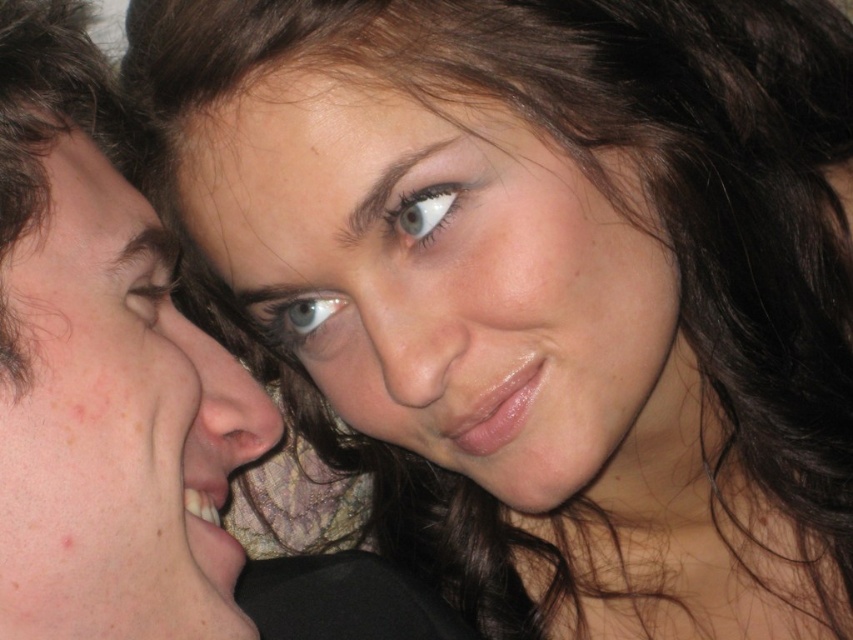
You are a photographer analyzing the composition of this closeup portrait. You notice the brown matte eyebrow at upper center. Can you determine its exact coordinates in the image frame?

The brown matte eyebrow at upper center is located at coordinates point (410, 193).

Looking at the image of the couple, which object has a greater width between the smooth skin face at center and the blue glossy eye at center?

The smooth skin face at center has a greater width than the blue glossy eye at center according to the description.

You are a photographer adjusting the focus of your camera. You want to ensure that both the smooth skin face at center and the blue glossy eye at center are in focus. Based on their positions, which one should you focus on first to achieve optimal sharpness?

The smooth skin face at center is closer to the viewer than the blue glossy eye at center. To achieve optimal sharpness, you should focus on the smooth skin face at center first, as it is nearer and will require adjusting the focus to accommodate its proximity before ensuring the blue glossy eye at center is also in focus.